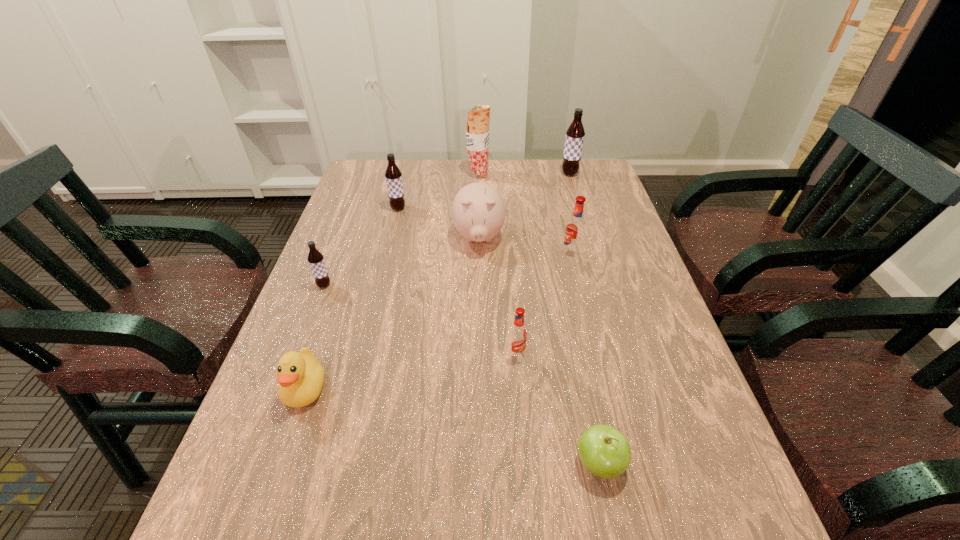
This screenshot has height=540, width=960. I want to click on empty space that is in between the rightmost brown root beer and the burrito, so click(524, 174).

The width and height of the screenshot is (960, 540). Identify the location of unoccupied area between the nearest root beer and the nearest object. (558, 408).

Identify the location of free spot between the green apple and the piggy bank. (539, 350).

I want to click on unoccupied area between the eighth tallest object and the second root beer from right to left, so click(x=439, y=321).

Locate which object ranks fourth in proximity to the duck. Please provide its 2D coordinates. Your answer should be formatted as a tuple, i.e. [(x, y)], where the tuple contains the x and y coordinates of a point satisfying the conditions above.

[(604, 451)]

Choose which object is the nearest neighbor to the left red root beer. Please provide its 2D coordinates. Your answer should be formatted as a tuple, i.e. [(x, y)], where the tuple contains the x and y coordinates of a point satisfying the conditions above.

[(604, 451)]

At what (x,y) coordinates should I click in order to perform the action: click on root beer object that ranks as the second closest to the second smallest brown root beer. Please return your answer as a coordinate pair (x, y). Image resolution: width=960 pixels, height=540 pixels. Looking at the image, I should click on (575, 229).

Select which root beer appears as the second closest to the third nearest root beer. Please provide its 2D coordinates. Your answer should be formatted as a tuple, i.e. [(x, y)], where the tuple contains the x and y coordinates of a point satisfying the conditions above.

[(575, 133)]

You are a GUI agent. You are given a task and a screenshot of the screen. Output one action in this format:
    pyautogui.click(x=<x>, y=<y>)
    Task: Click on the closest brown root beer to the farthest brown root beer
    Image resolution: width=960 pixels, height=540 pixels.
    Given the screenshot: What is the action you would take?
    pyautogui.click(x=393, y=175)

I want to click on brown root beer that stands as the third closest to the burrito, so click(316, 260).